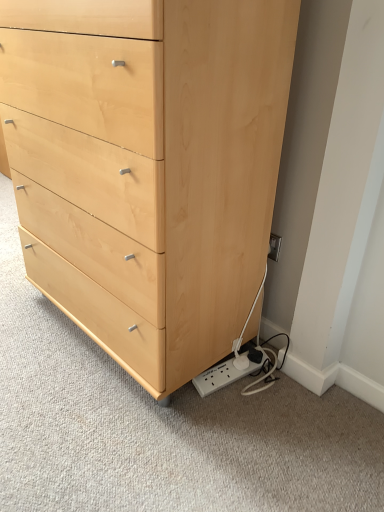
Where is `free space in front of white plastic power strip at lower right`? free space in front of white plastic power strip at lower right is located at coordinates (233, 420).